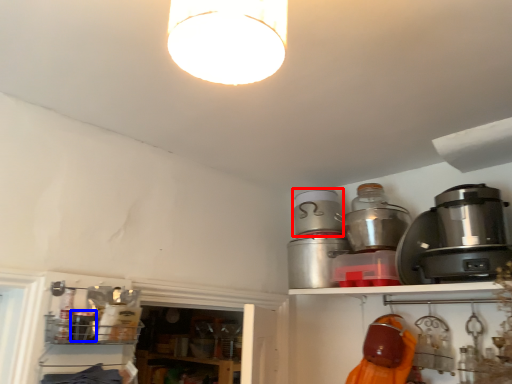
Question: Which object appears farthest to the camera in this image, appliance (highlighted by a red box) or appliance (highlighted by a blue box)?

Choices:
 (A) appliance
 (B) appliance

Answer: (A)